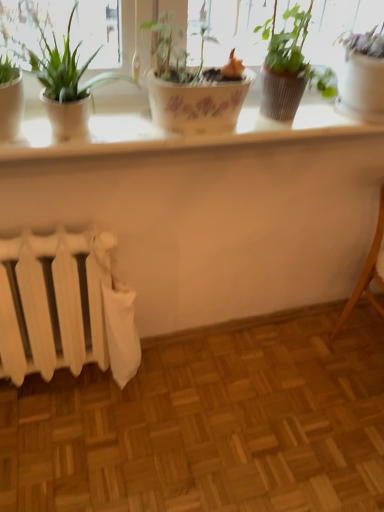
The height and width of the screenshot is (512, 384). What are the coordinates of `free space in front of white matte radiator at lower left` in the screenshot? It's located at (70, 442).